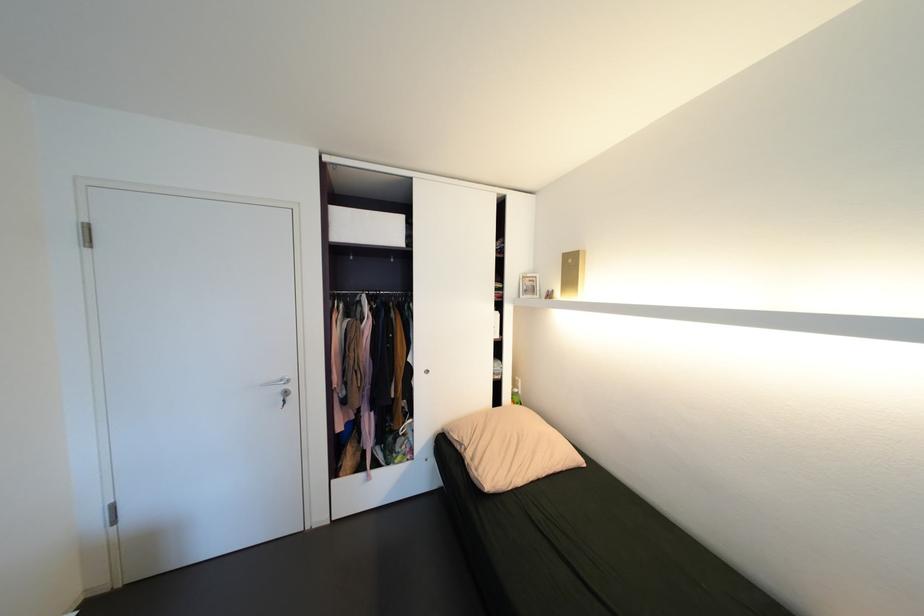
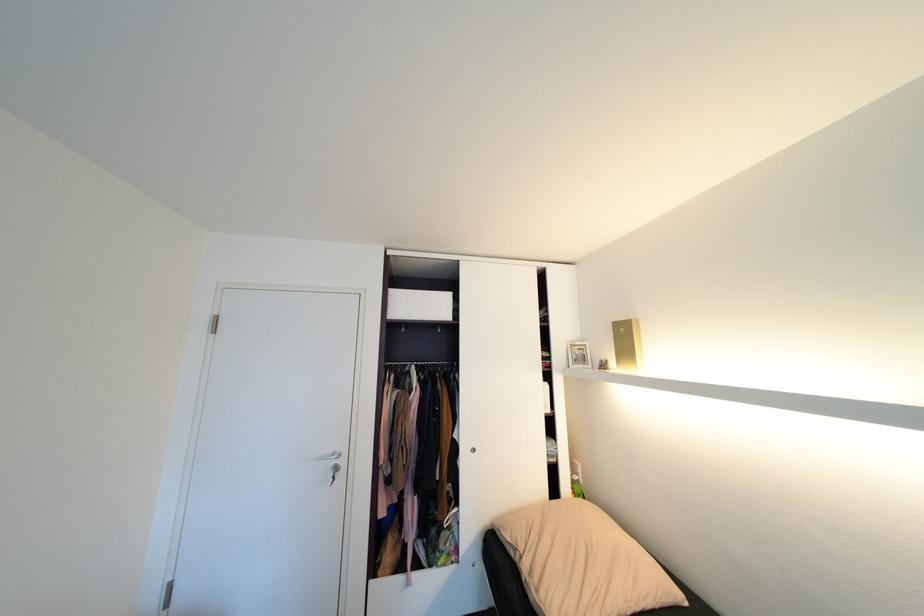
Question: How did the camera likely rotate?

Choices:
 (A) Left
 (B) Right
 (C) Up
 (D) Down

Answer: (C)